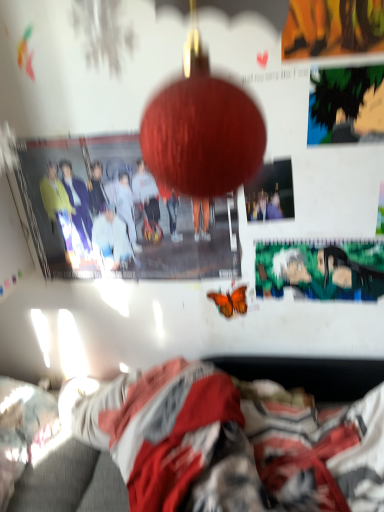
Question: In the image, is fluffy white pillow at lower left on the left side or the right side of fluffy blanket at lower center?

Choices:
 (A) left
 (B) right

Answer: (A)

Question: Looking at the image, does fluffy white pillow at lower left seem bigger or smaller compared to fluffy blanket at lower center?

Choices:
 (A) big
 (B) small

Answer: (B)

Question: Estimate the real-world distances between objects in this image. Which object is farther from the green matte poster at upper right, placed as the 3th poster page when sorted from back to front?

Choices:
 (A) orange matte butterfly at center
 (B) green matte poster at center, the 1th poster page from the back
 (C) fluffy blanket at lower center
 (D) matte paper poster at center, the second poster page viewed from the top
 (E) fluffy white pillow at lower left

Answer: (E)

Question: Which object is positioned closest to the green matte poster at upper right, the first poster page in the top-to-bottom sequence?

Choices:
 (A) green matte poster at center, which ranks as the 3th poster page in top-to-bottom order
 (B) fluffy blanket at lower center
 (C) orange matte butterfly at center
 (D) matte paper poster at center, which is counted as the second poster page, starting from the bottom
 (E) fluffy white pillow at lower left

Answer: (D)